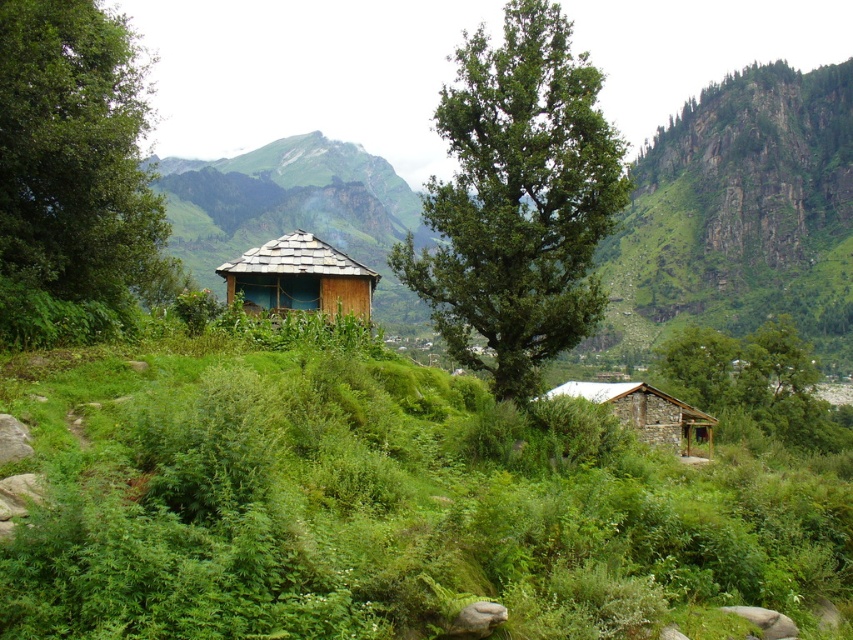
Question: Among these points, which one is farthest from the camera?

Choices:
 (A) (646, 390)
 (B) (511, 163)
 (C) (815, 420)
 (D) (247, 301)

Answer: (C)

Question: Is green leafy grass at center thinner than stone/wooden hut at lower right?

Choices:
 (A) yes
 (B) no

Answer: (B)

Question: Among these points, which one is farthest from the camera?

Choices:
 (A) (16, 612)
 (B) (647, 433)
 (C) (33, 260)
 (D) (595, 129)

Answer: (B)

Question: Does green leafy grass at center appear on the left side of green leafy tree at lower right?

Choices:
 (A) no
 (B) yes

Answer: (B)

Question: Can you confirm if green leafy tree at left is positioned below green leafy tree at lower right?

Choices:
 (A) yes
 (B) no

Answer: (B)

Question: Among these objects, which one is nearest to the camera?

Choices:
 (A) green leafy tree at lower right
 (B) green leafy tree at center

Answer: (B)